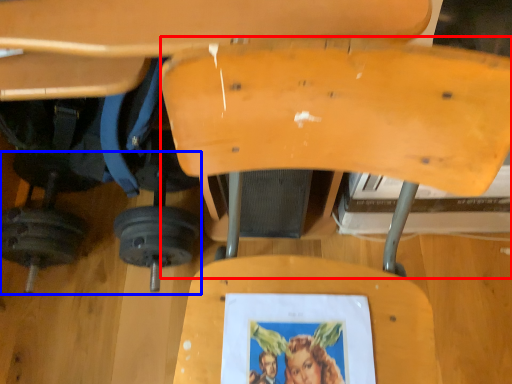
Question: Which object appears farthest to the camera in this image, swivel chair (highlighted by a red box) or barbell (highlighted by a blue box)?

Choices:
 (A) swivel chair
 (B) barbell

Answer: (B)